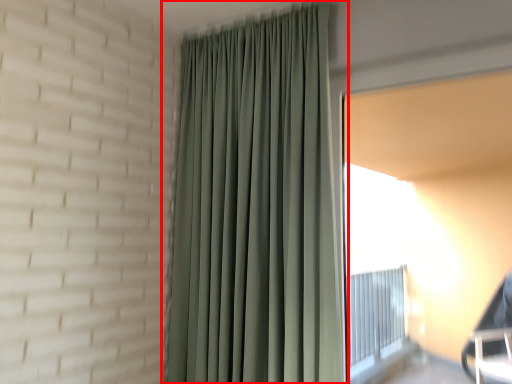
Question: Considering the relative positions of curtain (annotated by the red box) and window screen in the image provided, where is curtain (annotated by the red box) located with respect to the staircase?

Choices:
 (A) left
 (B) right

Answer: (A)